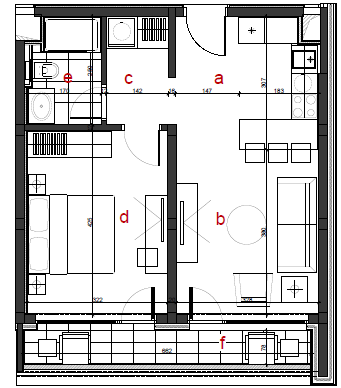
This screenshot has height=388, width=341. Identify the location of tub. (72, 35).